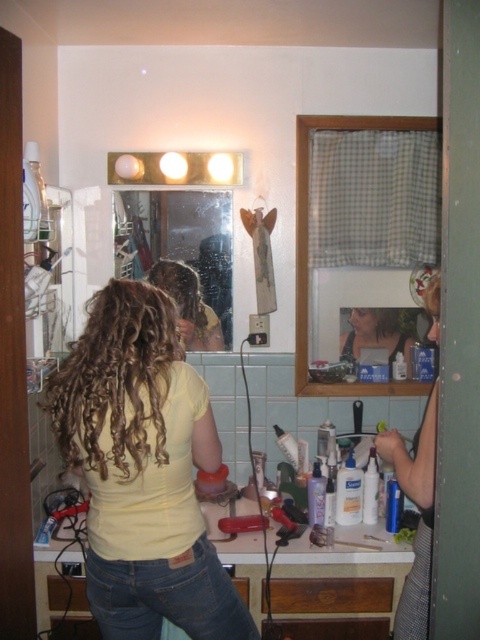
Between brown curly hair at back and clear glass mirror at center, which one is positioned higher?

clear glass mirror at center is higher up.

Can you confirm if brown curly hair at back is shorter than clear glass mirror at center?

Correct, brown curly hair at back is not as tall as clear glass mirror at center.

The image size is (480, 640). Describe the element at coordinates (116, 378) in the screenshot. I see `brown curly hair at back` at that location.

Where is `brown curly hair at back`? brown curly hair at back is located at coordinates (116, 378).

Is matte black hairbrush at upper right thinner than matte plastic bottle at upper center?

Yes, matte black hairbrush at upper right is thinner than matte plastic bottle at upper center.

Does matte black hairbrush at upper right have a larger size compared to matte plastic bottle at upper center?

Yes.

Find the location of a particular element. The height and width of the screenshot is (640, 480). matte black hairbrush at upper right is located at coordinates (420, 516).

Can you confirm if checkered fabric mirror at upper center is bigger than matte plastic bottle at upper center?

Yes.

Is point (298, 364) farther from camera compared to point (396, 333)?

No, it is not.

This screenshot has width=480, height=640. I want to click on checkered fabric mirror at upper center, so click(x=307, y=246).